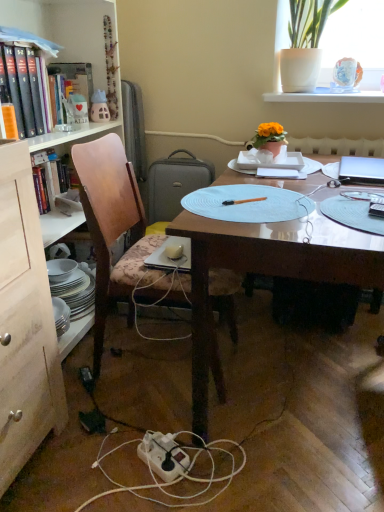
Find the location of a particular element. This screenshot has width=384, height=512. free spot in front of black plastic power plugs and sockets at lower left, which appears as the 1th power plugs and sockets when viewed from the back is located at coordinates (89, 409).